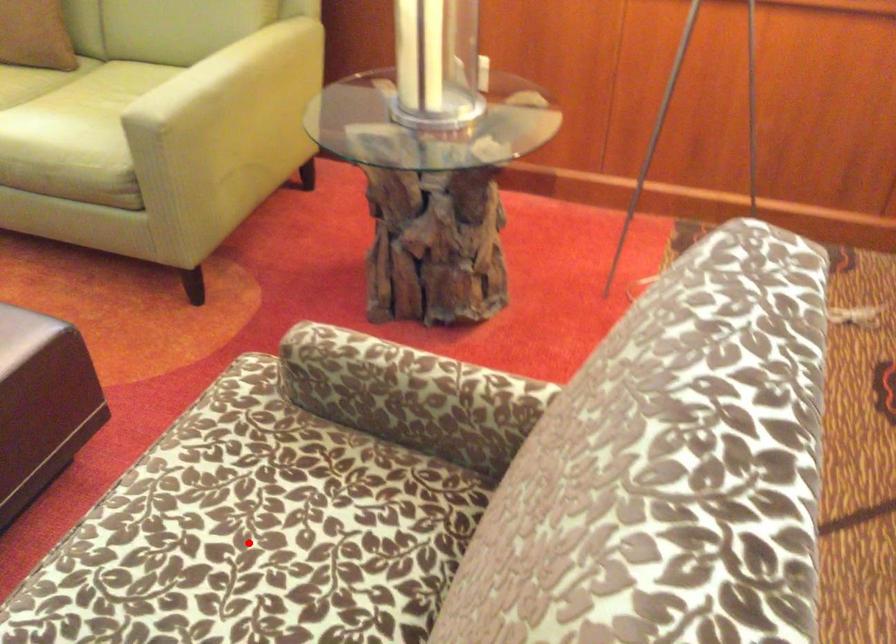
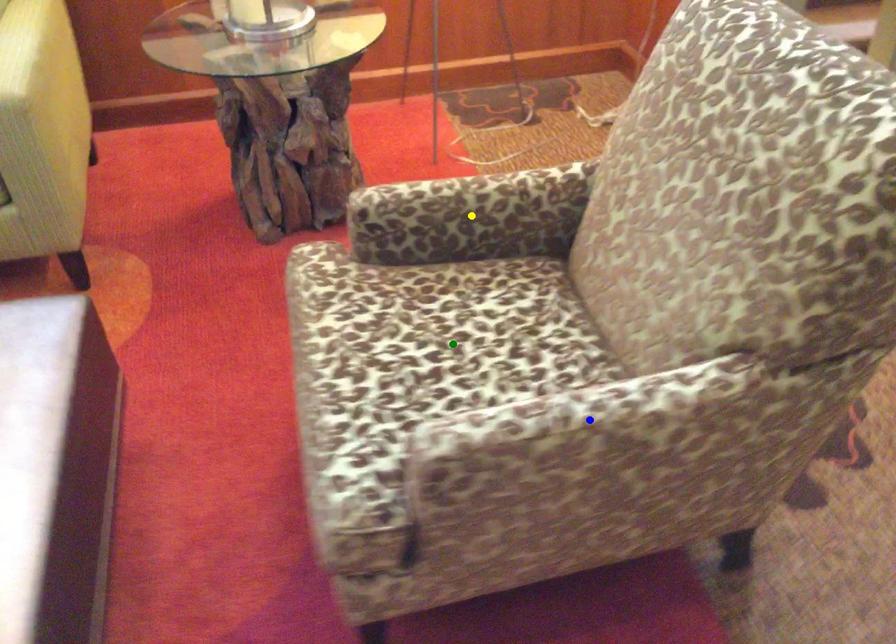
Question: I am providing you with two images of the same scene from different viewpoints. A red point is marked on the first image. You are given multiple points on the second image. Which spot in image 2 lines up with the point in image 1?

Choices:
 (A) blue point
 (B) green point
 (C) yellow point

Answer: (B)